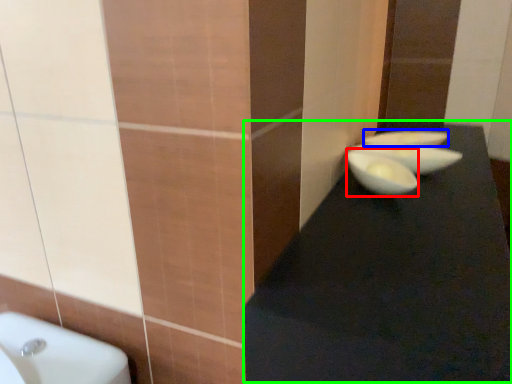
Question: Considering the real-world distances, which object is closest to glass bowl (highlighted by a red box)? basin (highlighted by a blue box) or table top (highlighted by a green box).

Choices:
 (A) basin
 (B) table top

Answer: (B)